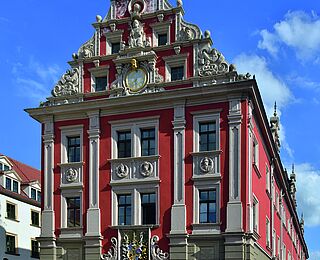
You are a GUI agent. You are given a task and a screenshot of the screen. Output one action in this format:
    pyautogui.click(x=<x>, y=<y>)
    Task: Click on the column
    Image resolution: width=320 pixels, height=260 pixels.
    Given the screenshot: What is the action you would take?
    pyautogui.click(x=48, y=164)